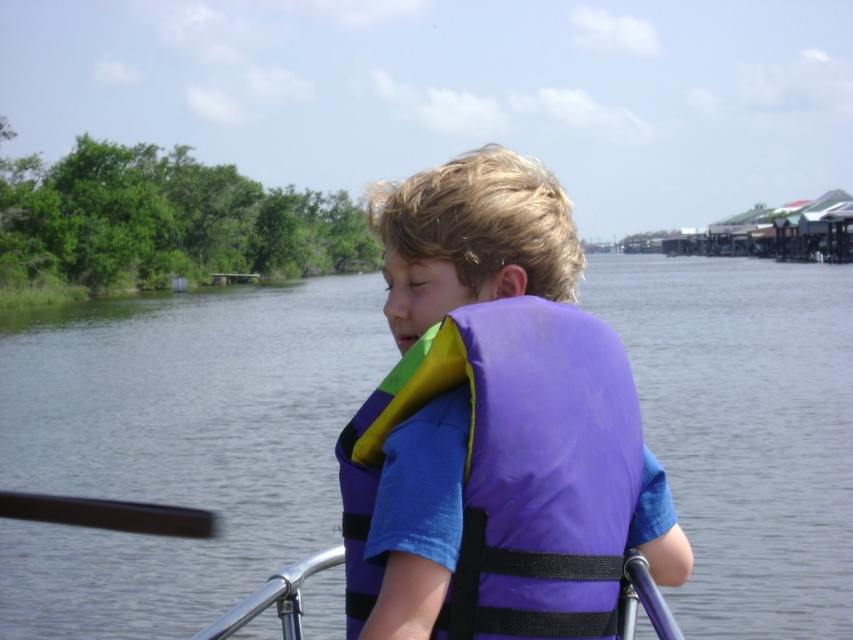
Question: Is purple life vest at center behind purple fabric life vest at center?

Choices:
 (A) yes
 (B) no

Answer: (A)

Question: Which point is farther from the camera taking this photo?

Choices:
 (A) (33, 528)
 (B) (436, 298)

Answer: (A)

Question: Does purple life vest at center appear on the left side of purple fabric life vest at center?

Choices:
 (A) no
 (B) yes

Answer: (A)

Question: Is purple life vest at center positioned before purple fabric life vest at center?

Choices:
 (A) yes
 (B) no

Answer: (B)